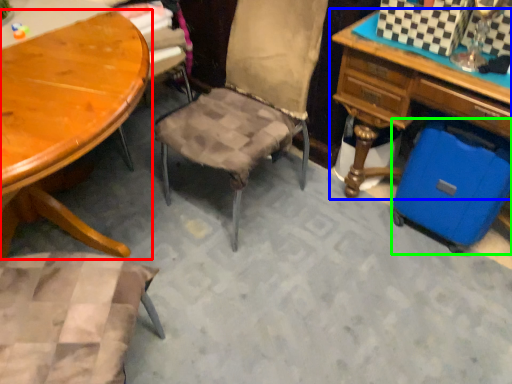
Question: Based on their relative distances, which object is nearer to table (highlighted by a red box)? Choose from desk (highlighted by a blue box) and luggage (highlighted by a green box).

Choices:
 (A) desk
 (B) luggage

Answer: (A)